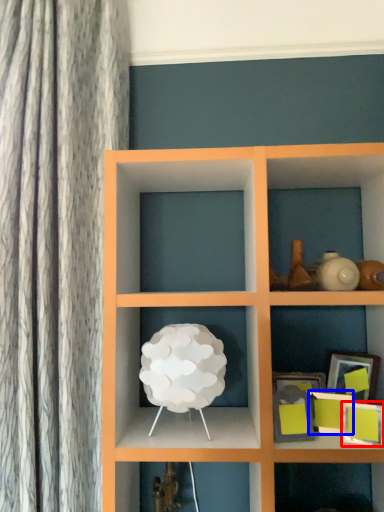
Question: Which of the following is the farthest to the observer, picture frame (highlighted by a red box) or picture frame (highlighted by a blue box)?

Choices:
 (A) picture frame
 (B) picture frame

Answer: (B)